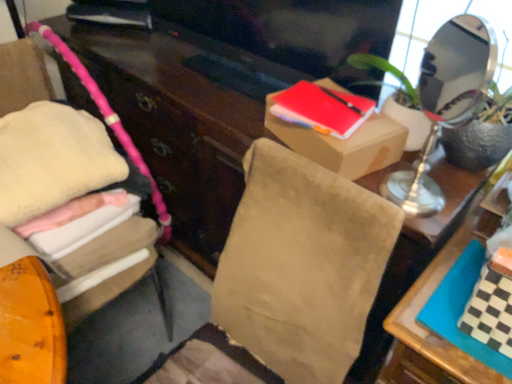
The height and width of the screenshot is (384, 512). Find the location of `empty space that is ontop of matte red notebook at upper center, the second book from the right`. empty space that is ontop of matte red notebook at upper center, the second book from the right is located at coordinates (317, 94).